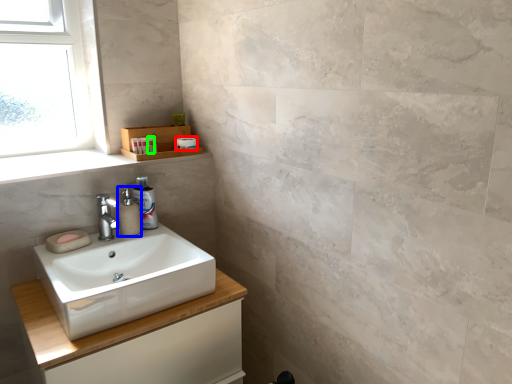
Question: Based on their relative distances, which object is nearer to toilet paper (highlighted by a red box)? Choose from soap dispenser (highlighted by a blue box) and toiletry (highlighted by a green box).

Choices:
 (A) soap dispenser
 (B) toiletry

Answer: (B)